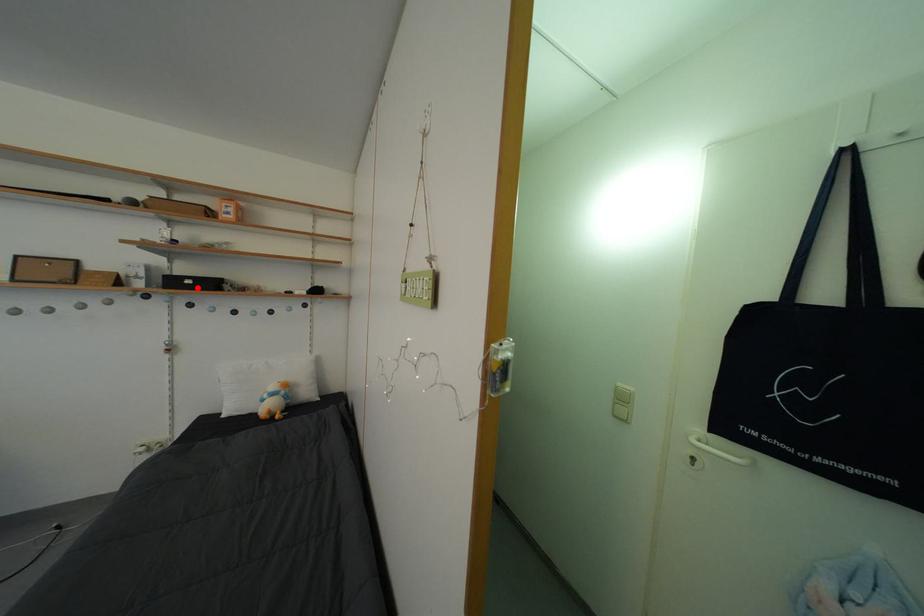
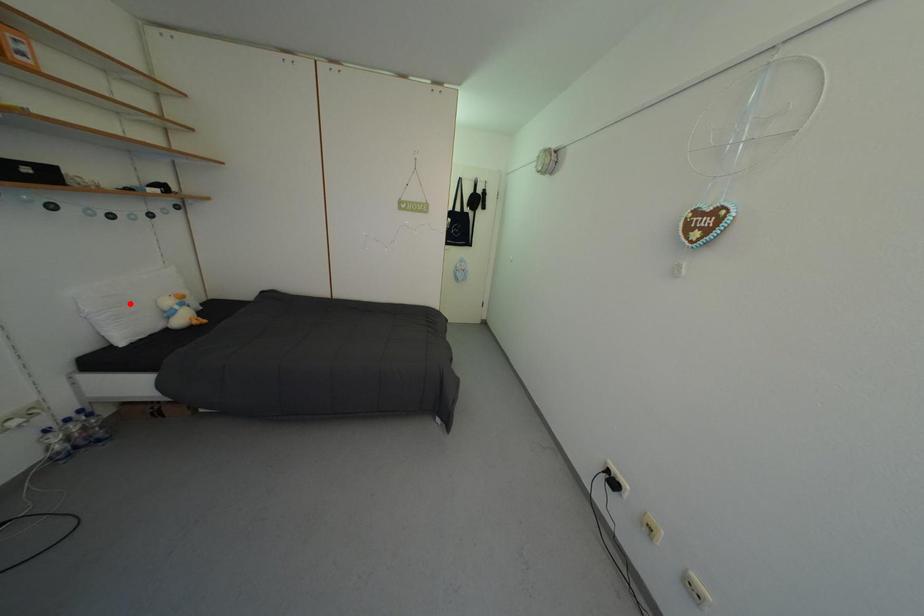
I am providing you with two images of the same scene from different viewpoints. A red point is marked on the first image and another point is marked on the second image. Is the red point in image1 aligned with the point shown in image2?

No